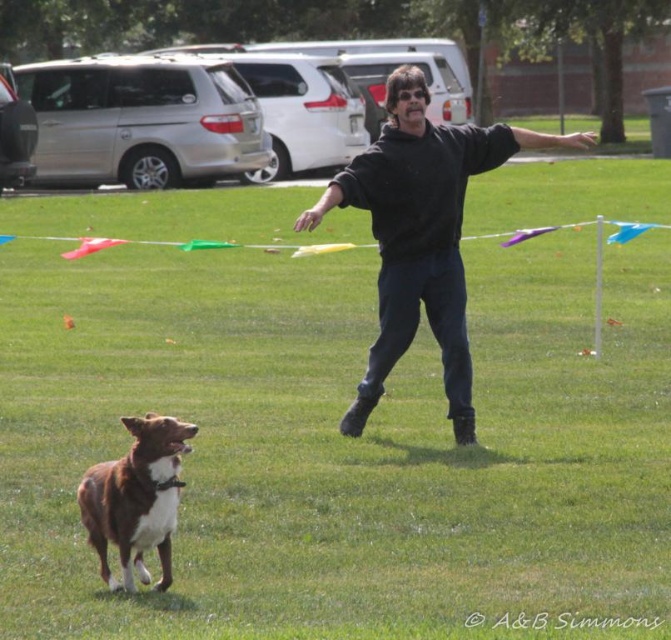
You are standing in the park scene and want to place a small flag at the nearest point to the camera between point [150,541] and point [68,237]. Which point should you choose?

Point [150,541] is closer to the camera than point [68,237], so you should choose point [150,541].

You are a drone operator who needs to deliver a small package to the brown furry dog at lower left. The multicolored fabric kite at center is blocking the direct flight path. Can you fly the drone around the kite to reach the dog?

The distance between the brown furry dog at lower left and the multicolored fabric kite at center is 6.09 meters. Since the kite is blocking the direct path, you can fly the drone around the kite to reach the dog as long as there is enough space to maneuver around the kite.